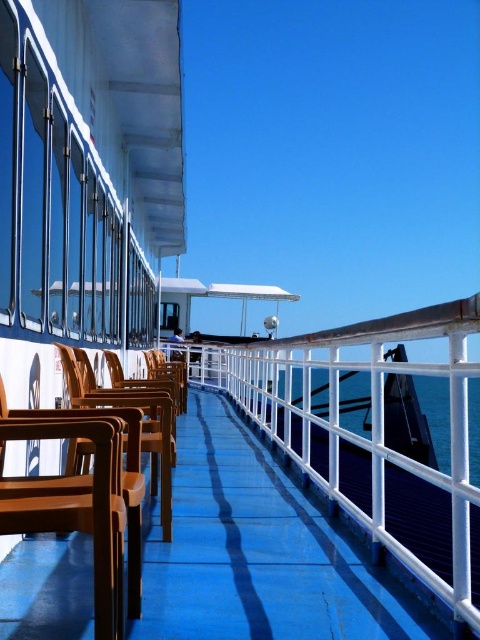
You are standing on the ferry deck and want to sit down. Where are the brown wood chairs at left located?

The brown wood chairs at left are located at point (x=255, y=550).

You are standing on the ferry deck and want to walk from point (220, 422) to point (358, 401). Which direction should you face to move towards the latter?

To move from point (220, 422) to point (358, 401), you should face towards the upper right direction since point (358, 401) is further away from the viewer compared to point (220, 422).